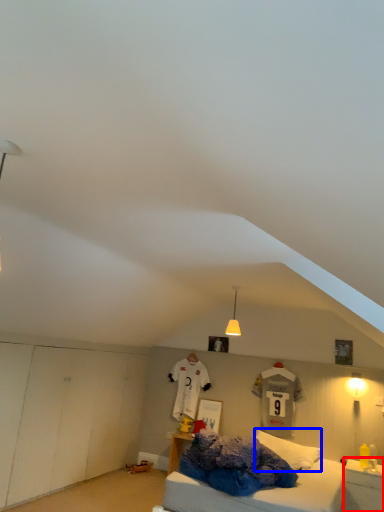
Question: Among these objects, which one is farthest to the camera, nightstand (highlighted by a red box) or pillow (highlighted by a blue box)?

Choices:
 (A) nightstand
 (B) pillow

Answer: (B)